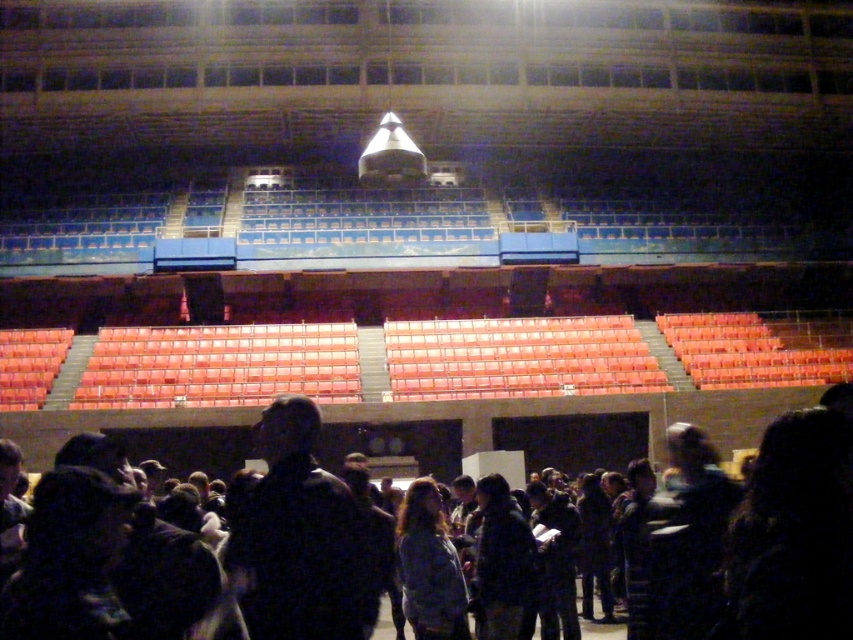
Question: Which of the following is the closest to the observer?

Choices:
 (A) dark matte jacket at center
 (B) dark clothing at center

Answer: (A)

Question: Can you confirm if dark matte jacket at center is positioned above dark clothing at center?

Choices:
 (A) no
 (B) yes

Answer: (B)

Question: In this image, where is dark matte jacket at center located relative to dark clothing at center?

Choices:
 (A) right
 (B) left

Answer: (B)

Question: Does dark matte jacket at center have a smaller size compared to dark clothing at center?

Choices:
 (A) no
 (B) yes

Answer: (B)

Question: Which point appears closest to the camera in this image?

Choices:
 (A) (339, 596)
 (B) (469, 448)

Answer: (A)